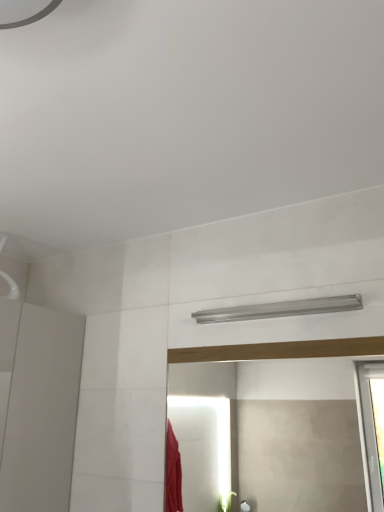
Question: Is point (276, 420) closer or farther from the camera than point (339, 298)?

Choices:
 (A) farther
 (B) closer

Answer: (A)

Question: Which is correct: matte wooden mirror at center is inside silver metallic shower at upper center, or outside of it?

Choices:
 (A) outside
 (B) inside

Answer: (A)

Question: From a real-world perspective, is matte wooden mirror at center physically located above or below silver metallic shower at upper center?

Choices:
 (A) below
 (B) above

Answer: (A)

Question: Is point (241, 314) positioned closer to the camera than point (327, 442)?

Choices:
 (A) farther
 (B) closer

Answer: (B)

Question: Do you think silver metallic shower at upper center is within matte wooden mirror at center, or outside of it?

Choices:
 (A) inside
 (B) outside

Answer: (B)

Question: From a real-world perspective, is silver metallic shower at upper center above or below matte wooden mirror at center?

Choices:
 (A) below
 (B) above

Answer: (B)

Question: Looking at the image, does silver metallic shower at upper center seem bigger or smaller compared to matte wooden mirror at center?

Choices:
 (A) big
 (B) small

Answer: (B)